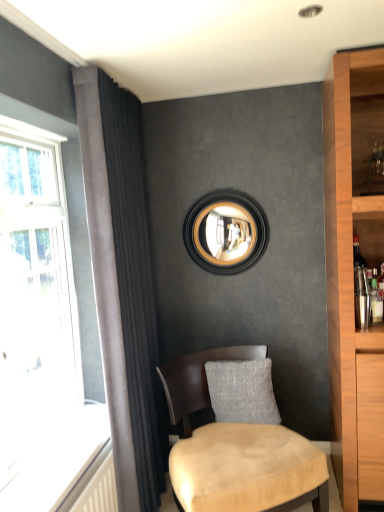
Question: Does gray textured pillow at center have a larger size compared to dark grey velvet curtain at left?

Choices:
 (A) yes
 (B) no

Answer: (B)

Question: Is gray textured pillow at center touching dark grey velvet curtain at left?

Choices:
 (A) no
 (B) yes

Answer: (A)

Question: Does gray textured pillow at center appear on the left side of dark grey velvet curtain at left?

Choices:
 (A) no
 (B) yes

Answer: (A)

Question: From the image's perspective, is gray textured pillow at center beneath dark grey velvet curtain at left?

Choices:
 (A) no
 (B) yes

Answer: (B)

Question: Considering the relative sizes of gray textured pillow at center and dark grey velvet curtain at left in the image provided, is gray textured pillow at center thinner than dark grey velvet curtain at left?

Choices:
 (A) no
 (B) yes

Answer: (A)

Question: Does point (213, 248) appear closer or farther from the camera than point (157, 340)?

Choices:
 (A) farther
 (B) closer

Answer: (A)

Question: In the image, is black wood picture frame at upper center on the left side or the right side of dark grey velvet curtain at left?

Choices:
 (A) right
 (B) left

Answer: (A)

Question: Looking at their shapes, would you say black wood picture frame at upper center is wider or thinner than dark grey velvet curtain at left?

Choices:
 (A) thin
 (B) wide

Answer: (A)

Question: Is black wood picture frame at upper center spatially inside dark grey velvet curtain at left, or outside of it?

Choices:
 (A) inside
 (B) outside

Answer: (B)

Question: In terms of height, does suede beige chair at lower center look taller or shorter compared to gray textured pillow at center?

Choices:
 (A) short
 (B) tall

Answer: (B)

Question: From the image's perspective, is suede beige chair at lower center above or below gray textured pillow at center?

Choices:
 (A) above
 (B) below

Answer: (B)

Question: Based on their sizes in the image, would you say suede beige chair at lower center is bigger or smaller than gray textured pillow at center?

Choices:
 (A) small
 (B) big

Answer: (B)

Question: Considering the relative positions of suede beige chair at lower center and gray textured pillow at center in the image provided, is suede beige chair at lower center to the left or to the right of gray textured pillow at center?

Choices:
 (A) right
 (B) left

Answer: (B)

Question: Is dark grey velvet curtain at left wider or thinner than gray textured pillow at center?

Choices:
 (A) thin
 (B) wide

Answer: (A)

Question: Based on their sizes in the image, would you say dark grey velvet curtain at left is bigger or smaller than gray textured pillow at center?

Choices:
 (A) big
 (B) small

Answer: (A)